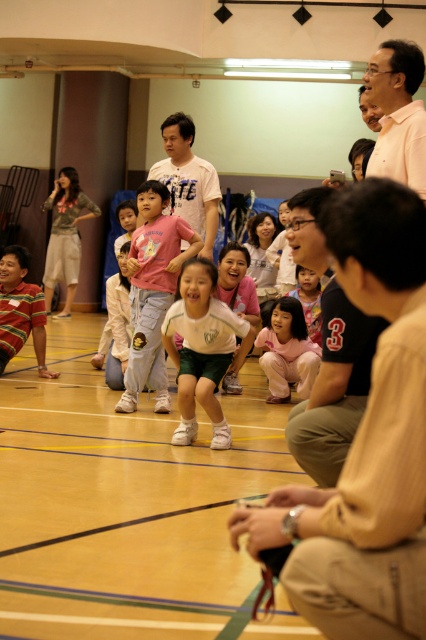
Question: Can you confirm if striped cotton shirt at lower left is bigger than matte pink shirt at center?

Choices:
 (A) yes
 (B) no

Answer: (A)

Question: Which point is closer to the camera?

Choices:
 (A) (5, 291)
 (B) (192, 253)
 (C) (313, 316)
 (D) (279, 304)

Answer: (B)

Question: Does black shirt at center appear under pink cotton shirt at center?

Choices:
 (A) no
 (B) yes

Answer: (B)

Question: Which of these objects is positioned farthest from the black shirt at center?

Choices:
 (A) white matte shirt at center
 (B) pink cotton shirt at center
 (C) white matte shorts at center
 (D) striped cotton shirt at lower left

Answer: (D)

Question: Is white matte shirt at center to the right of pink fabric pants at center from the viewer's perspective?

Choices:
 (A) no
 (B) yes

Answer: (A)

Question: Which object is the farthest from the pink smooth shirt at upper right?

Choices:
 (A) black t-shirt at center
 (B) pink fabric pants at center

Answer: (B)